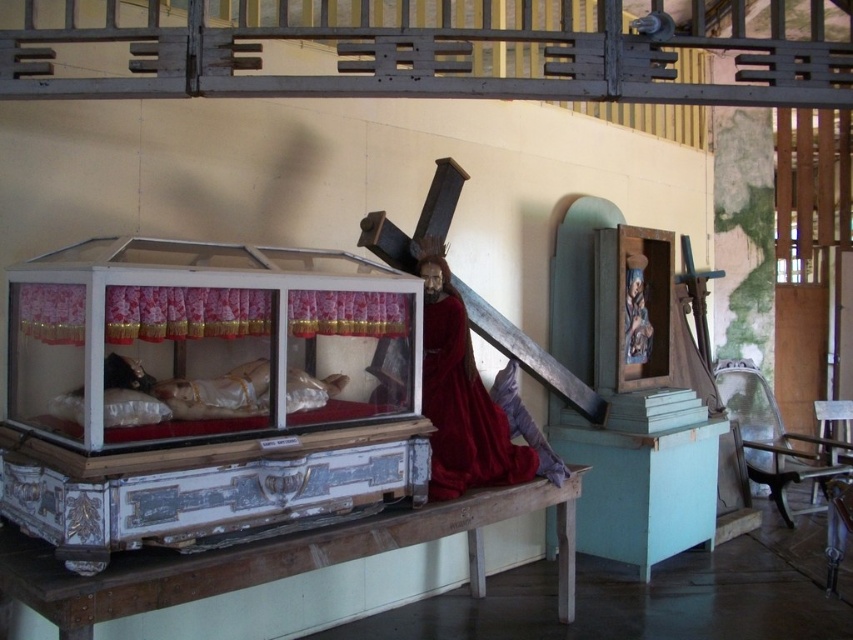
Between white painted wood altar at lower center and red velvet robe at center, which one has more height?

red velvet robe at center is taller.

Based on the photo, is white painted wood altar at lower center behind red velvet robe at center?

No, it is in front of red velvet robe at center.

Locate an element on the screen. The width and height of the screenshot is (853, 640). white painted wood altar at lower center is located at coordinates (273, 557).

Identify the location of white painted wood altar at lower center. Image resolution: width=853 pixels, height=640 pixels. (273, 557).

Is point (125, 360) positioned behind point (28, 602)?

Yes, it is behind point (28, 602).

Based on the photo, is white painted wood sarcophagus at center smaller than white painted wood altar at lower center?

Yes, white painted wood sarcophagus at center is smaller than white painted wood altar at lower center.

At what (x,y) coordinates should I click in order to perform the action: click on white painted wood sarcophagus at center. Please return your answer as a coordinate pair (x, y). The width and height of the screenshot is (853, 640). Looking at the image, I should click on (202, 392).

Between white painted wood sarcophagus at center and red velvet robe at center, which one is positioned higher?

Positioned higher is white painted wood sarcophagus at center.

Which is more to the left, white painted wood sarcophagus at center or red velvet robe at center?

Positioned to the left is white painted wood sarcophagus at center.

What do you see at coordinates (202, 392) in the screenshot? This screenshot has width=853, height=640. I see `white painted wood sarcophagus at center` at bounding box center [202, 392].

Where is `white painted wood sarcophagus at center`? white painted wood sarcophagus at center is located at coordinates (202, 392).